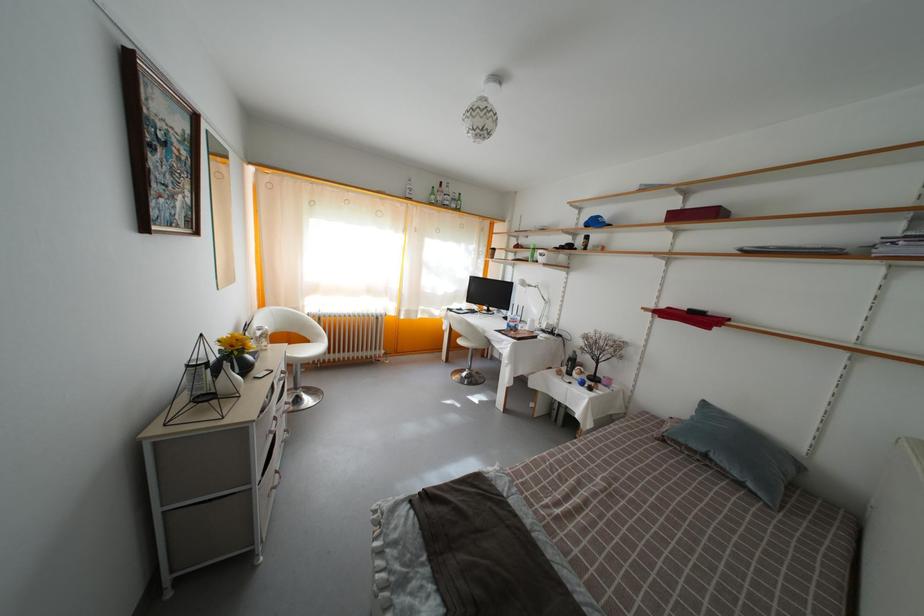
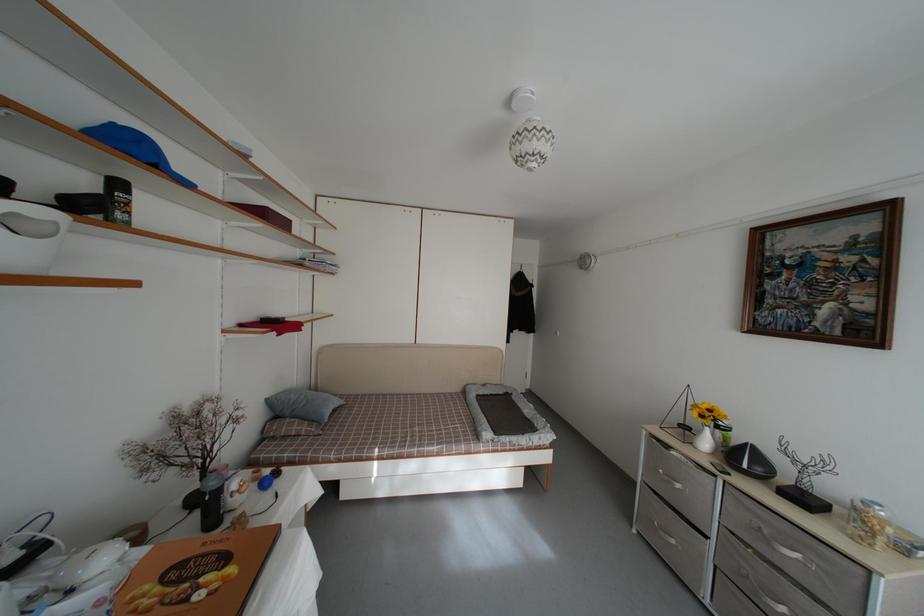
In the second image, find the point that corresponds to the point at 687,459 in the first image.

(332, 431)